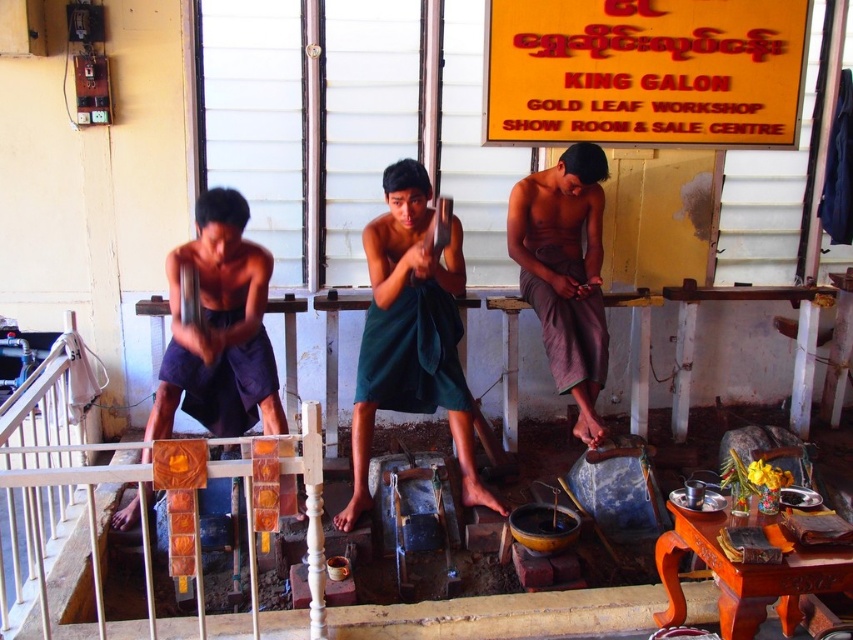
What color is the fabric located at point (219, 330)?

The fabric at point (219, 330) is dark blue.

Consider the image. You are a visitor in this gold leaf workshop and see the green fabric at center and the gray cotton pants at center. Which item is located below the other?

The green fabric at center is positioned under the gray cotton pants at center, so the green fabric is below the gray cotton pants.